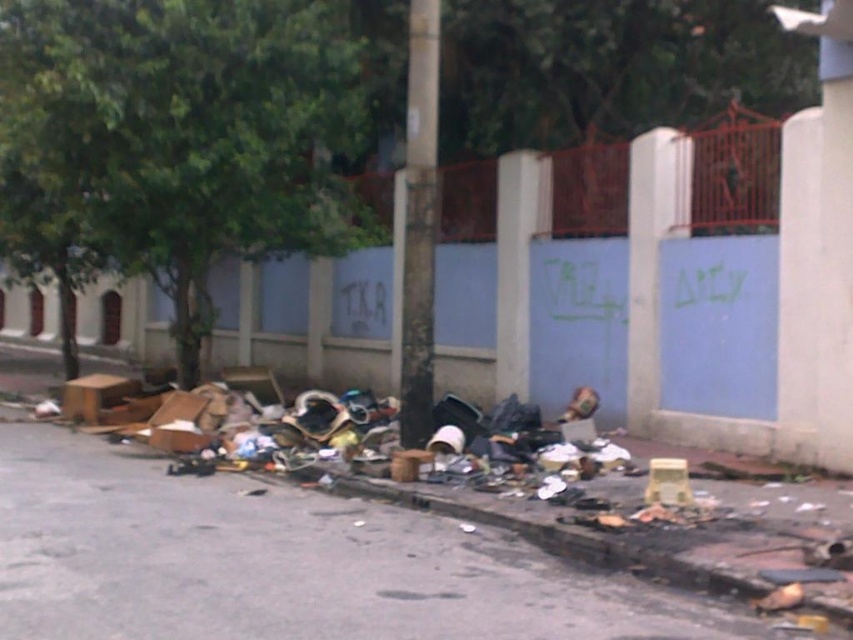
Question: Which point is closer to the camera taking this photo?

Choices:
 (A) 10,1
 (B) 386,566

Answer: (B)

Question: Is green leafy tree at upper left to the left of dirty asphalt pavement at lower center from the viewer's perspective?

Choices:
 (A) yes
 (B) no

Answer: (A)

Question: Is green leafy tree at upper left further to camera compared to dirty asphalt pavement at lower center?

Choices:
 (A) yes
 (B) no

Answer: (A)

Question: Can you confirm if green leafy tree at upper left is smaller than dirty asphalt pavement at lower center?

Choices:
 (A) no
 (B) yes

Answer: (B)